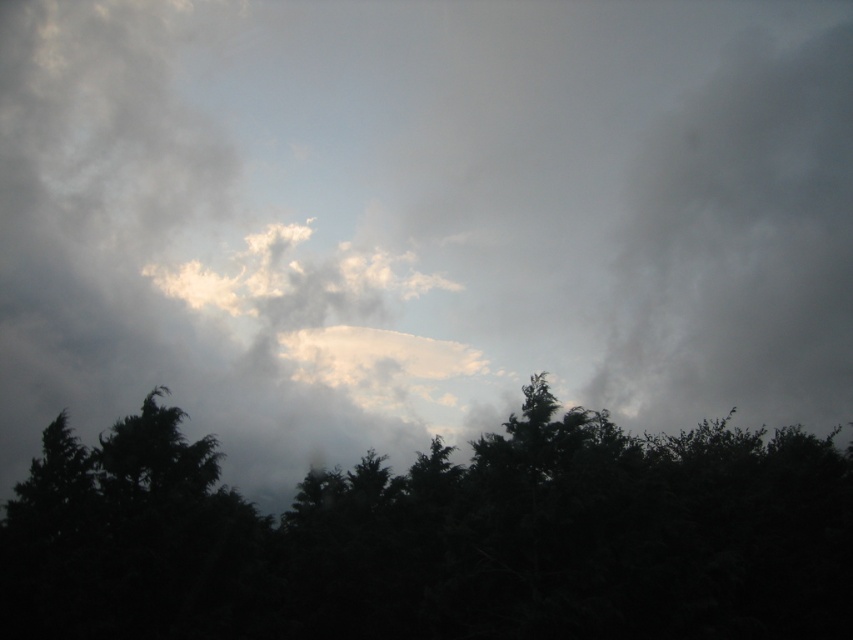
The height and width of the screenshot is (640, 853). What do you see at coordinates (437, 538) in the screenshot? I see `dark green foliage at center` at bounding box center [437, 538].

Is point (57, 608) positioned in front of point (664, 141)?

Yes, it is in front of point (664, 141).

Image resolution: width=853 pixels, height=640 pixels. Find the location of `dark green foliage at center`. dark green foliage at center is located at coordinates (437, 538).